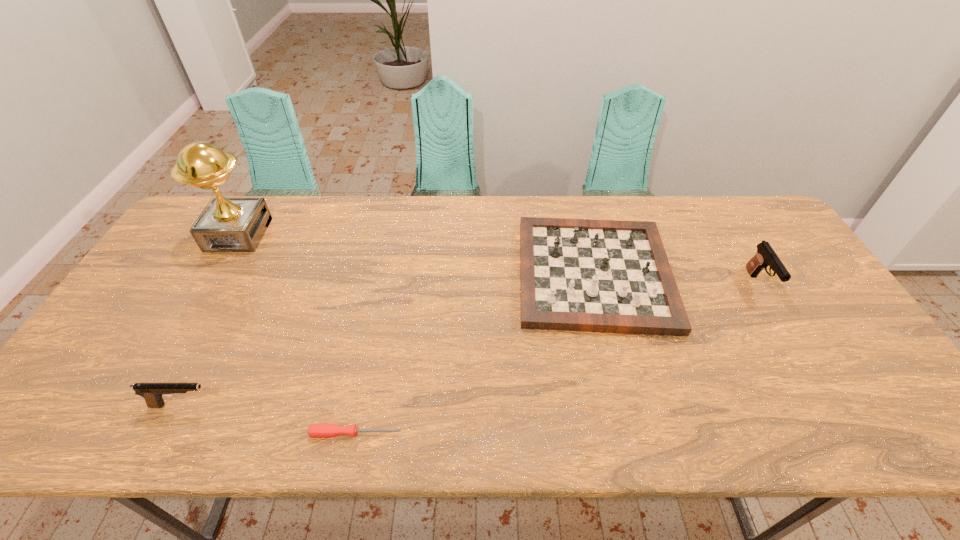
You are a GUI agent. You are given a task and a screenshot of the screen. Output one action in this format:
    pyautogui.click(x=<x>, y=<y>)
    Task: Click on the award
    
    Given the screenshot: What is the action you would take?
    [227, 224]

Image resolution: width=960 pixels, height=540 pixels. Identify the location of the rightmost object. (765, 256).

I want to click on the taller pistol, so click(765, 256).

The height and width of the screenshot is (540, 960). I want to click on the second object from right to left, so click(610, 276).

Where is `the left pistol`? Image resolution: width=960 pixels, height=540 pixels. the left pistol is located at coordinates (152, 392).

Where is `the nearer pistol`? The image size is (960, 540). the nearer pistol is located at coordinates (152, 392).

You are a GUI agent. You are given a task and a screenshot of the screen. Output one action in this format:
    pyautogui.click(x=<x>, y=<y>)
    Task: Click on the nearest object
    The image size is (960, 540).
    Given the screenshot: What is the action you would take?
    pyautogui.click(x=314, y=430)

Find the location of a particular element. This screenshot has width=960, height=540. the third object from left to right is located at coordinates (314, 430).

This screenshot has height=540, width=960. Find the location of `free space located on the front-facing side of the award`. free space located on the front-facing side of the award is located at coordinates (201, 300).

Locate an element on the screen. vacant area situated at the barrel of the right pistol is located at coordinates (837, 417).